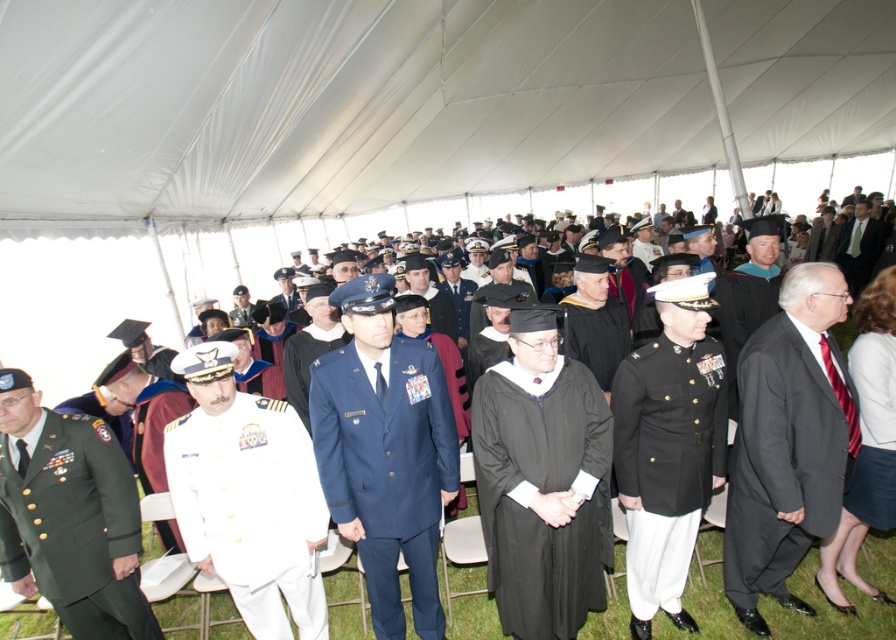
Question: Is green military uniform at center closer to camera compared to black wool suit at right?

Choices:
 (A) no
 (B) yes

Answer: (A)

Question: Is green military uniform at center behind dark gray suit at center?

Choices:
 (A) no
 (B) yes

Answer: (A)

Question: Among these points, which one is nearest to the camera?

Choices:
 (A) (409, 563)
 (B) (696, 445)

Answer: (B)

Question: Is green military uniform at center wider than white wool blazer at center?

Choices:
 (A) no
 (B) yes

Answer: (B)

Question: Among these points, which one is nearest to the camera?

Choices:
 (A) (714, 464)
 (B) (869, 470)
 (C) (389, 604)
 (D) (273, 417)

Answer: (D)

Question: Estimate the real-world distances between objects in this image. Which object is farther from the white wool blazer at center?

Choices:
 (A) green military uniform at center
 (B) black matte military uniform at center
 (C) white matte uniform at center

Answer: (C)